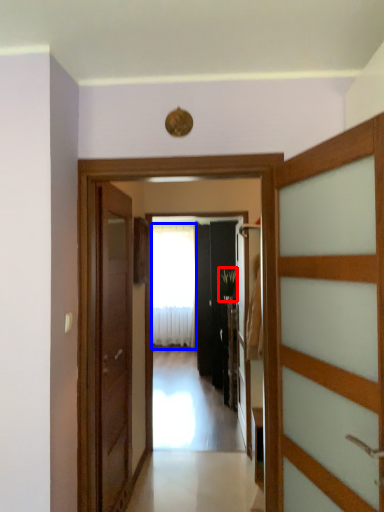
Question: Which object is closer to the camera taking this photo, plant (highlighted by a red box) or curtain (highlighted by a blue box)?

Choices:
 (A) plant
 (B) curtain

Answer: (A)